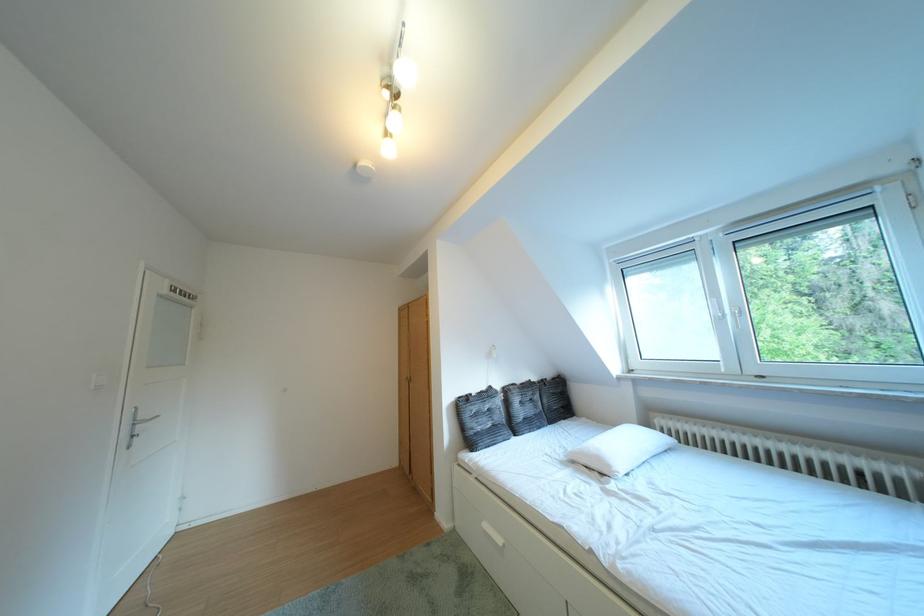
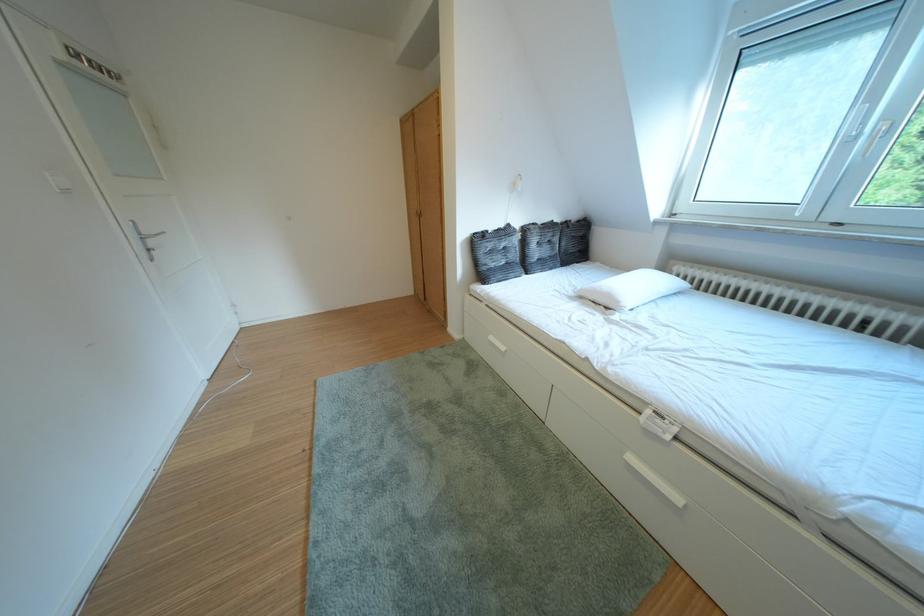
Find the pixel in the second image that matches (x=563, y=379) in the first image.

(588, 222)